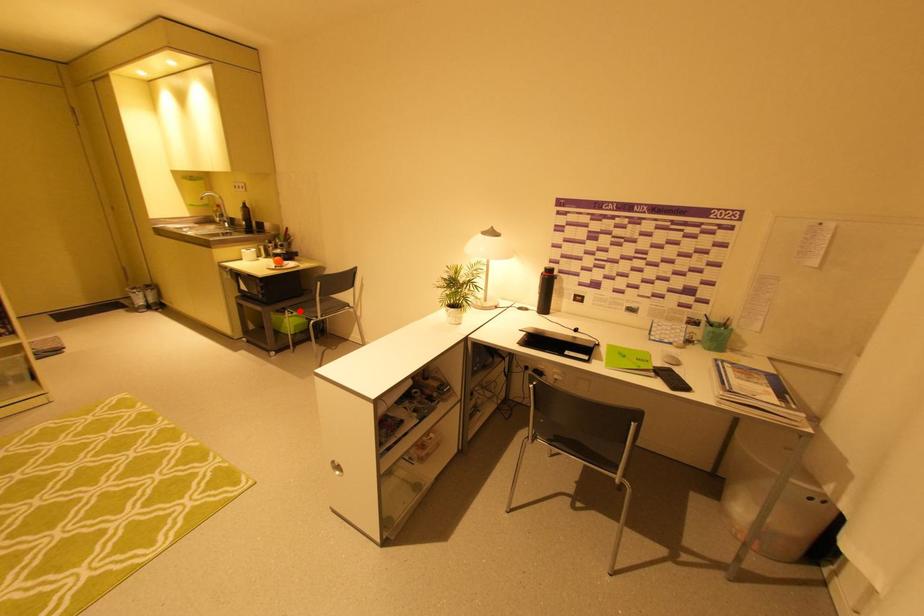
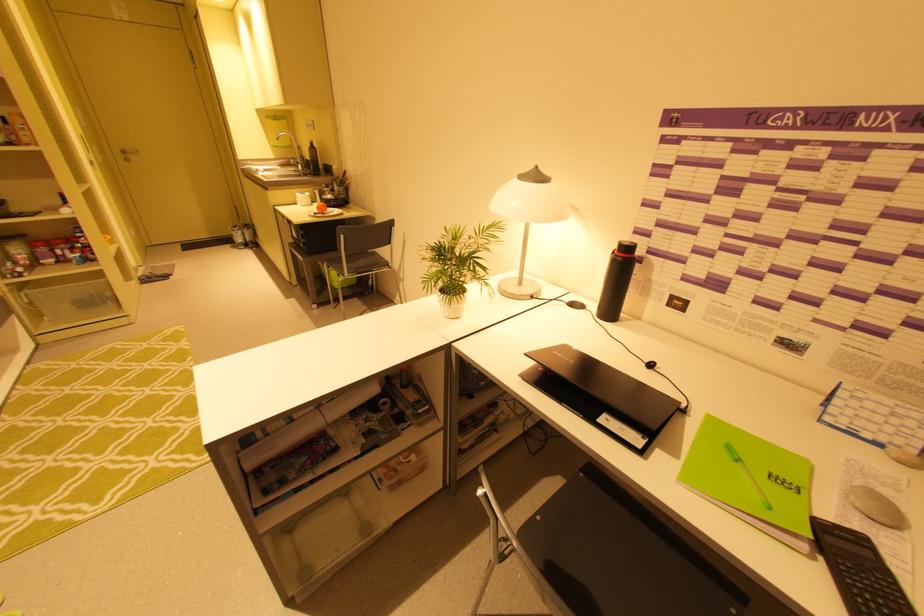
Find the pixel in the second image that matches the highlighted location in the first image.

(334, 265)